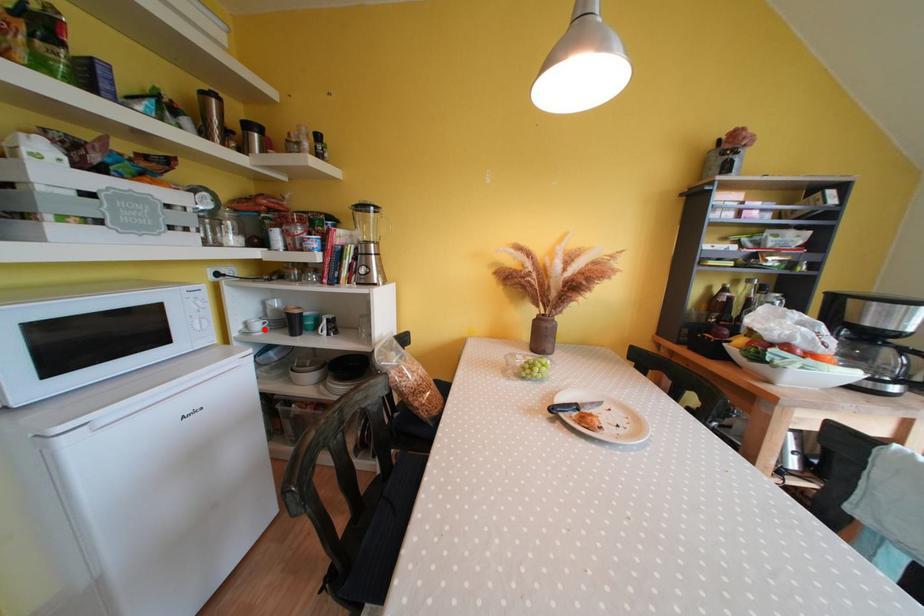
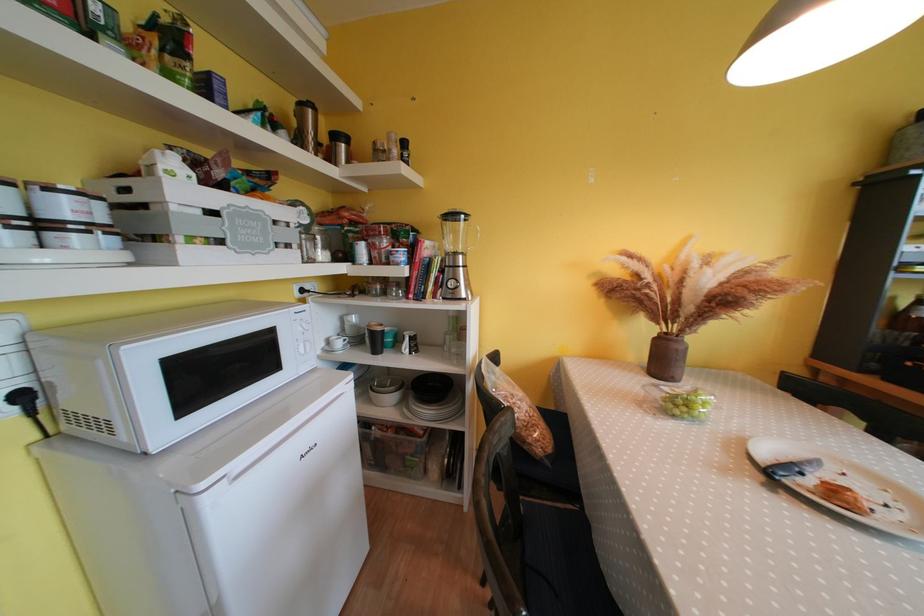
Locate, in the second image, the point that corresponds to the highlighted location in the first image.

(345, 347)